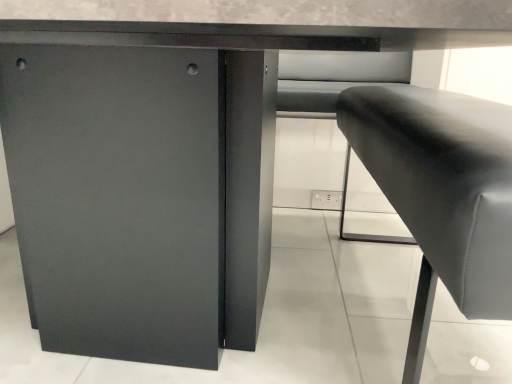
At what (x,y) coordinates should I click in order to perform the action: click on black leather chair at right. Please return your answer as a coordinate pair (x, y). This screenshot has width=512, height=384. Looking at the image, I should click on (441, 193).

What do you see at coordinates (441, 193) in the screenshot?
I see `black leather chair at right` at bounding box center [441, 193].

The image size is (512, 384). What are the coordinates of `black leather chair at right` in the screenshot? It's located at (441, 193).